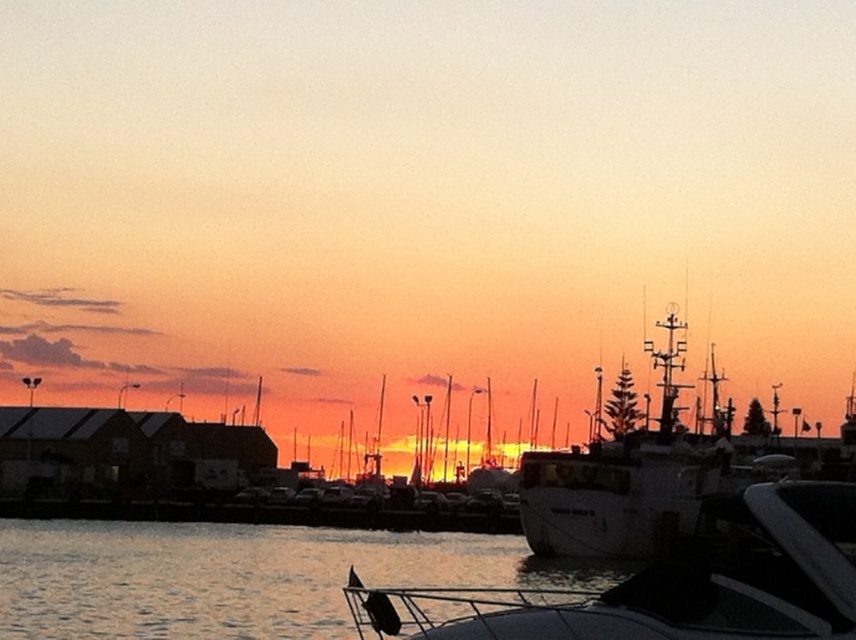
Is glistening water at lower center wider than white matte boat at center?

Indeed, glistening water at lower center has a greater width compared to white matte boat at center.

Between point (310, 624) and point (835, 566), which one is positioned in front?

Point (835, 566) is more forward.

Who is more distant from viewer, (x=271, y=573) or (x=833, y=589)?

The point (x=271, y=573) is more distant.

You are a GUI agent. You are given a task and a screenshot of the screen. Output one action in this format:
    pyautogui.click(x=<x>, y=<y>)
    Task: Click on the glistening water at lower center
    
    Given the screenshot: What is the action you would take?
    pyautogui.click(x=235, y=577)